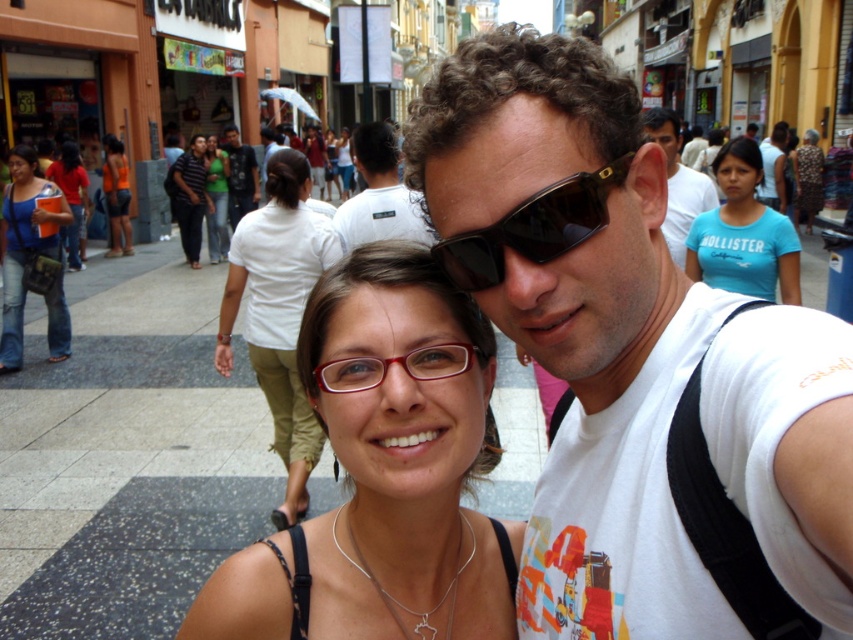
Is the position of black plastic sunglasses at center more distant than that of white shirt at center?

No, it is in front of white shirt at center.

This screenshot has height=640, width=853. What do you see at coordinates (532, 227) in the screenshot? I see `black plastic sunglasses at center` at bounding box center [532, 227].

The image size is (853, 640). Find the location of `black plastic sunglasses at center`. black plastic sunglasses at center is located at coordinates (532, 227).

Where is `black plastic sunglasses at center`? The width and height of the screenshot is (853, 640). black plastic sunglasses at center is located at coordinates tap(532, 227).

Between white cotton shirt at center and printed fabric dress at center, which one has less height?

printed fabric dress at center

Is white cotton shirt at center to the right of printed fabric dress at center from the viewer's perspective?

In fact, white cotton shirt at center is to the left of printed fabric dress at center.

Identify the location of white cotton shirt at center. (279, 312).

Can you confirm if matte blue t-shirt at upper right is positioned to the right of matte white shirt at center?

Incorrect, matte blue t-shirt at upper right is not on the right side of matte white shirt at center.

Is matte blue t-shirt at upper right thinner than matte white shirt at center?

Incorrect, matte blue t-shirt at upper right's width is not less than matte white shirt at center's.

Between point (798, 296) and point (778, 154), which one is positioned behind?

Positioned behind is point (778, 154).

The width and height of the screenshot is (853, 640). What are the coordinates of `matte blue t-shirt at upper right` in the screenshot? It's located at (743, 234).